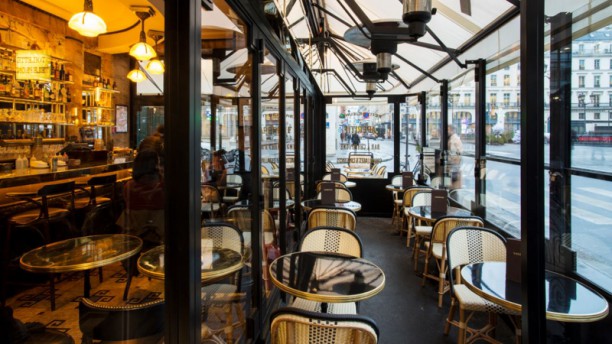
Identify the location of round tables. (488, 276), (336, 274), (234, 262), (101, 253), (428, 213), (401, 189), (349, 183), (352, 204).